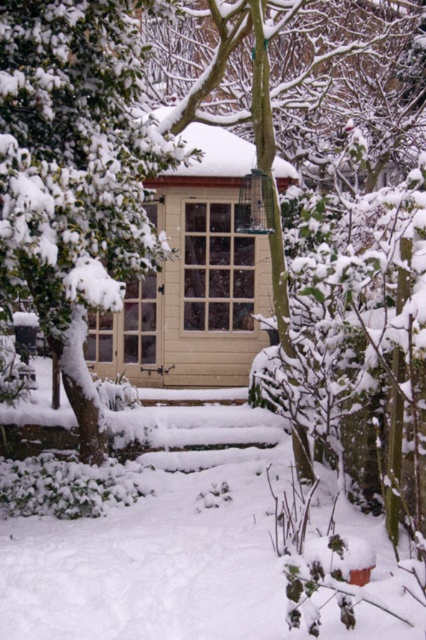
This screenshot has height=640, width=426. Identify the location of green textured tree at left. (74, 173).

Between green textured tree at left and wooden window at center, which one appears on the right side from the viewer's perspective?

From the viewer's perspective, wooden window at center appears more on the right side.

Does point (63, 172) come behind point (215, 253)?

No, it is not.

I want to click on green textured tree at left, so click(74, 173).